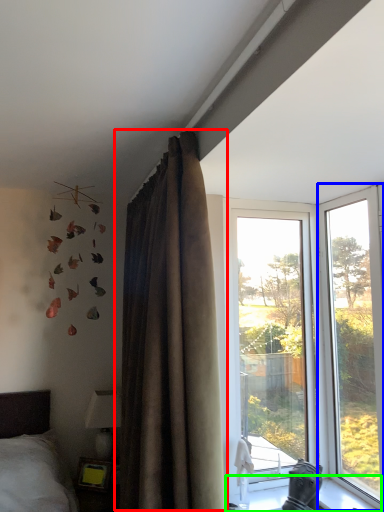
Question: Which object is the farthest from curtain (highlighted by a red box)? Choose among these: window (highlighted by a blue box) or window sill (highlighted by a green box).

Choices:
 (A) window
 (B) window sill

Answer: (A)